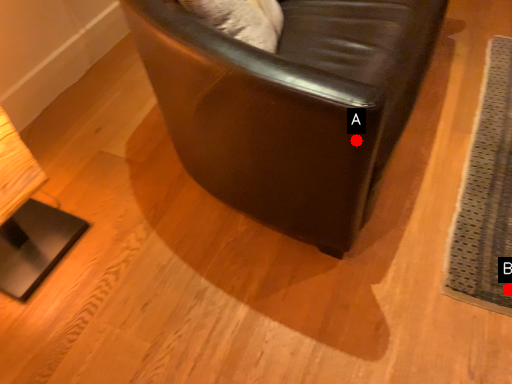
Question: Two points are circled on the image, labeled by A and B beside each circle. Which point is closer to the camera?

Choices:
 (A) A is closer
 (B) B is closer

Answer: (A)